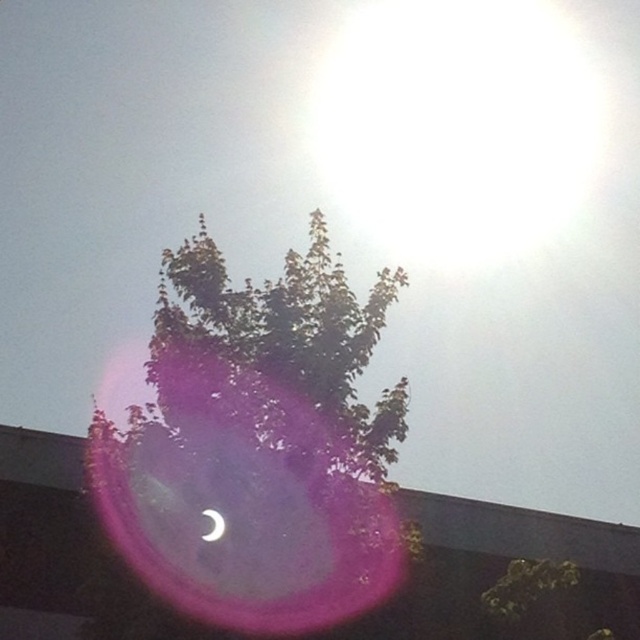
You are an astronomer analyzing this image. You need to determine which object occupies more horizontal space in the frame between the green leafy tree at center and the satin white crescent at upper center. Based on the scene description, which one is wider?

The green leafy tree at center is wider than the satin white crescent at upper center.

You are an astronomer analyzing this image. You notice two points of interest labeled as point 1 at coordinates point (211,522) and point 2 at coordinates point (442,228). Based on the scene, which point is closer to your observation position?

Point (211,522) is closer to the viewer than point (442,228).

You are an astronomer analyzing this image. You see a point at coordinates (257, 445). What object does this point correspond to?

The point at coordinates (257, 445) corresponds to the green leafy tree at center.